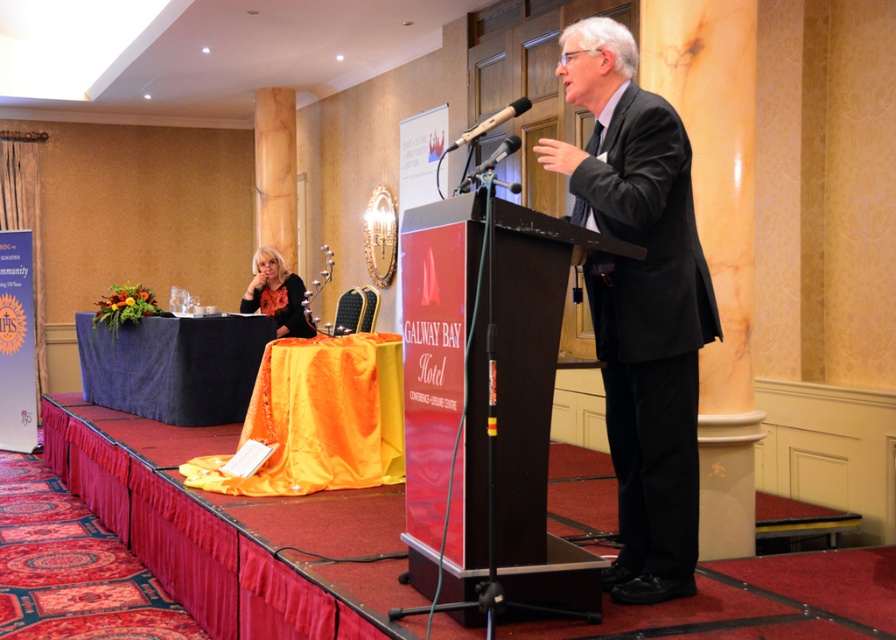
You are an event planner setting up the Galway Bay Hotel conference room. You need to place a new decorative centerpiece between the velvet blue tablecloth at left and the black plastic microphone at center. Where should you position it?

The velvet blue tablecloth at left is to the left of the black plastic microphone at center, so place the decorative centerpiece between them, ensuring it is positioned to the right of the velvet blue tablecloth at left and to the left of the black plastic microphone at center.

You are standing at the back of the room and want to take a photo of the speaker at the podium. Which point, point 1 at coordinates (x=545, y=292) or point 2 at coordinates (x=282, y=275), is closer to the camera and would result in a clearer photo?

Point 1 at coordinates (x=545, y=292) is closer to the camera than point 2 at coordinates (x=282, y=275), so taking a photo from that point would result in a clearer image.

Consider the image. You are an event organizer who needs to adjust the microphones during a speech. Which microphone, the metallic silver microphone at center or the black plastic microphone at center, is positioned closer to the speaker?

The metallic silver microphone at center is closer to the viewer than the black plastic microphone at center, so the metallic silver microphone at center is positioned closer to the speaker.